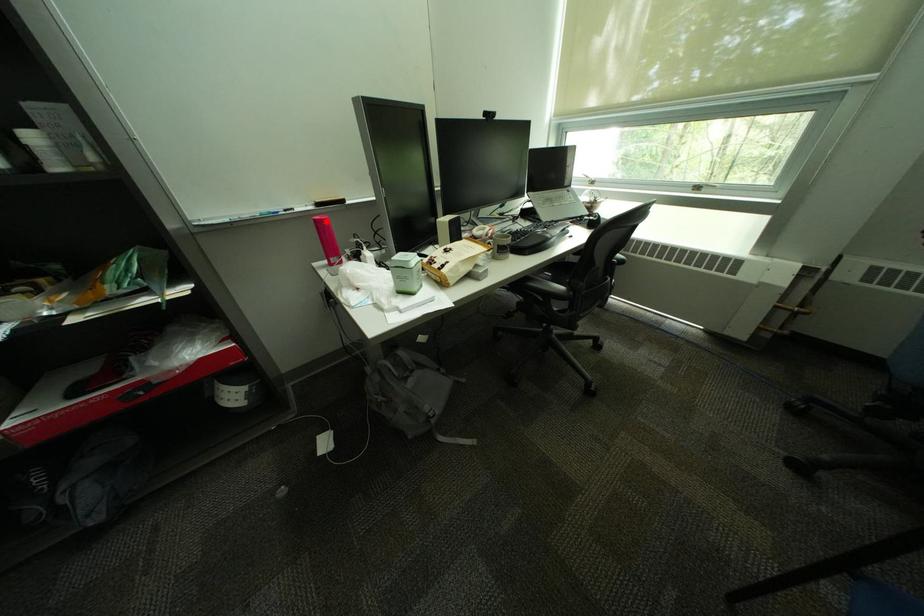
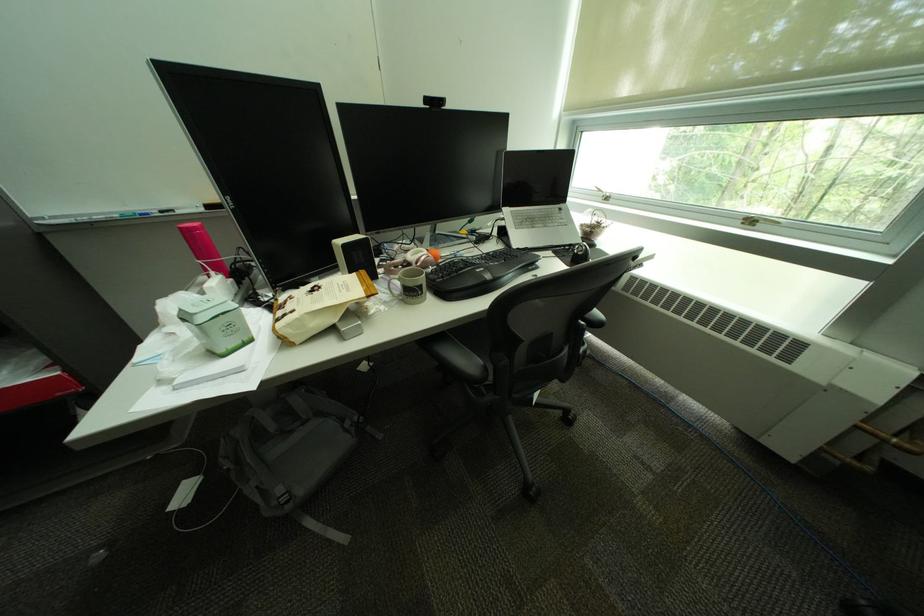
The point at the highlighted location is marked in the first image. Where is the corresponding point in the second image?

(190, 230)